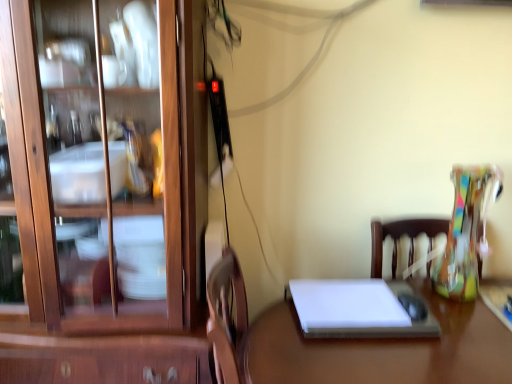
What do you see at coordinates (349, 308) in the screenshot? I see `white matte notebook at center` at bounding box center [349, 308].

The image size is (512, 384). In order to click on white glossy desk at center in this screenshot , I will do `click(381, 349)`.

This screenshot has width=512, height=384. Describe the element at coordinates (381, 349) in the screenshot. I see `white glossy desk at center` at that location.

The height and width of the screenshot is (384, 512). Find the location of `white matte notebook at center`. white matte notebook at center is located at coordinates (349, 308).

Considering the relative sizes of wooden cabinet at left and white matte notebook at center in the image provided, is wooden cabinet at left wider than white matte notebook at center?

Indeed, wooden cabinet at left has a greater width compared to white matte notebook at center.

Considering the positions of objects wooden cabinet at left and white matte notebook at center in the image provided, who is more to the left, wooden cabinet at left or white matte notebook at center?

Positioned to the left is wooden cabinet at left.

Consider the image. From the image's perspective, does wooden cabinet at left appear lower than white matte notebook at center?

No, from the image's perspective, wooden cabinet at left is not below white matte notebook at center.

Is wooden cabinet at left bigger than white matte notebook at center?

Correct, wooden cabinet at left is larger in size than white matte notebook at center.

Is white matte notebook at center with white glossy desk at center?

white matte notebook at center and white glossy desk at center are not in contact.

Which of these two, white matte notebook at center or white glossy desk at center, is bigger?

white glossy desk at center.

Is white matte notebook at center to the left of white glossy desk at center from the viewer's perspective?

In fact, white matte notebook at center is to the right of white glossy desk at center.

From the picture: Is white glossy desk at center directly adjacent to wooden cabinet at left?

No, white glossy desk at center is not making contact with wooden cabinet at left.

Which object is wider, white glossy desk at center or wooden cabinet at left?

white glossy desk at center.

Find the location of a particular element. cabinetry to the left of white glossy desk at center is located at coordinates (102, 158).

Is white matte notebook at center thinner than wooden cabinet at left?

Correct, the width of white matte notebook at center is less than that of wooden cabinet at left.

Can you confirm if white matte notebook at center is bigger than wooden cabinet at left?

Actually, white matte notebook at center might be smaller than wooden cabinet at left.

Considering the positions of objects white matte notebook at center and wooden cabinet at left in the image provided, who is more to the right, white matte notebook at center or wooden cabinet at left?

white matte notebook at center.

In the scene shown: Is white matte notebook at center placed right next to wooden cabinet at left?

white matte notebook at center and wooden cabinet at left are clearly separated.

Is wooden cabinet at left smaller than white glossy desk at center?

No, wooden cabinet at left is not smaller than white glossy desk at center.

Is wooden cabinet at left completely or partially outside of white glossy desk at center?

Yes, wooden cabinet at left is not within white glossy desk at center.

Locate an element on the screen. desk below the wooden cabinet at left (from the image's perspective) is located at coordinates (381, 349).

In terms of height, does white glossy desk at center look taller or shorter compared to white matte notebook at center?

In the image, white glossy desk at center appears to be taller than white matte notebook at center.

Is white matte notebook at center at the back of white glossy desk at center?

white glossy desk at center does not have its back to white matte notebook at center.

Measure the distance from white glossy desk at center to white matte notebook at center.

white glossy desk at center is 4.30 inches away from white matte notebook at center.

Does white glossy desk at center contain white matte notebook at center?

Yes, white matte notebook at center is a part of white glossy desk at center.

I want to click on cabinetry that is above the white matte notebook at center (from the image's perspective), so click(102, 158).

At what (x,y) coordinates should I click in order to perform the action: click on desk on the left of white matte notebook at center. Please return your answer as a coordinate pair (x, y). The width and height of the screenshot is (512, 384). Looking at the image, I should click on (381, 349).

Looking at the image, which one is located closer to wooden cabinet at left, white matte notebook at center or white glossy desk at center?

white matte notebook at center is closer to wooden cabinet at left.

Considering their positions, is wooden cabinet at left positioned further to white glossy desk at center than white matte notebook at center?

Based on the image, wooden cabinet at left appears to be further to white glossy desk at center.

Based on the photo, from the image, which object appears to be nearer to white matte notebook at center, white glossy desk at center or wooden cabinet at left?

white glossy desk at center is positioned closer to the anchor white matte notebook at center.

When comparing their distances from white matte notebook at center, does wooden cabinet at left or white glossy desk at center seem closer?

white glossy desk at center.

Which object lies nearer to the anchor point wooden cabinet at left, white glossy desk at center or white matte notebook at center?

Based on the image, white matte notebook at center appears to be nearer to wooden cabinet at left.

Considering their positions, is white matte notebook at center positioned closer to white glossy desk at center than wooden cabinet at left?

white matte notebook at center lies closer to white glossy desk at center than the other object.

The image size is (512, 384). What are the coordinates of `desk between wooden cabinet at left and white matte notebook at center in the horizontal direction` in the screenshot? It's located at (381, 349).